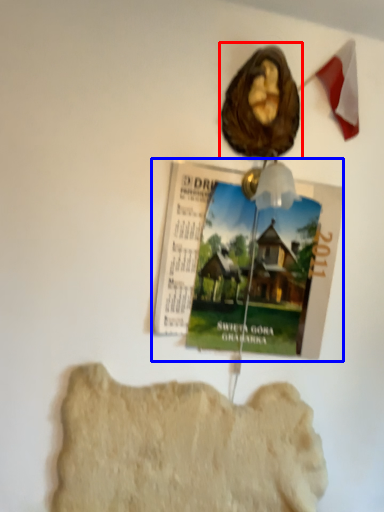
Question: Which object appears closest to the camera in this image, art (highlighted by a red box) or magazine (highlighted by a blue box)?

Choices:
 (A) art
 (B) magazine

Answer: (A)